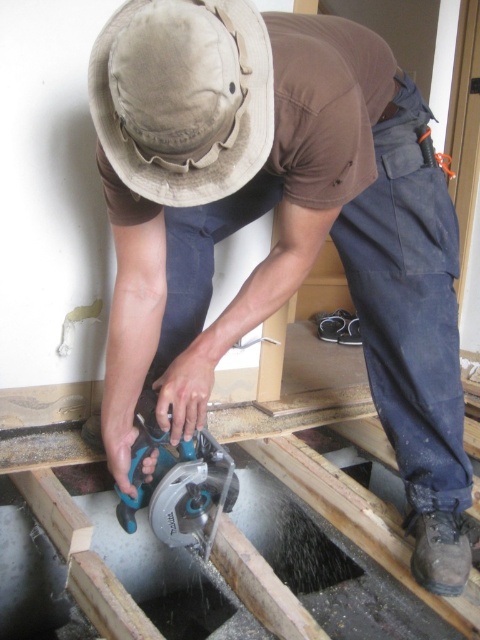
Question: Which of the following is the farthest from the observer?

Choices:
 (A) tan fabric hat at upper center
 (B) blue plastic circular saw at center

Answer: (B)

Question: Is tan fabric hat at upper center to the left of blue plastic circular saw at center from the viewer's perspective?

Choices:
 (A) yes
 (B) no

Answer: (B)

Question: Is the position of tan fabric hat at upper center more distant than that of blue plastic circular saw at center?

Choices:
 (A) no
 (B) yes

Answer: (A)

Question: Which point is farther to the camera?

Choices:
 (A) (145, 65)
 (B) (126, 515)

Answer: (B)

Question: Does tan fabric hat at upper center appear over blue plastic circular saw at center?

Choices:
 (A) yes
 (B) no

Answer: (A)